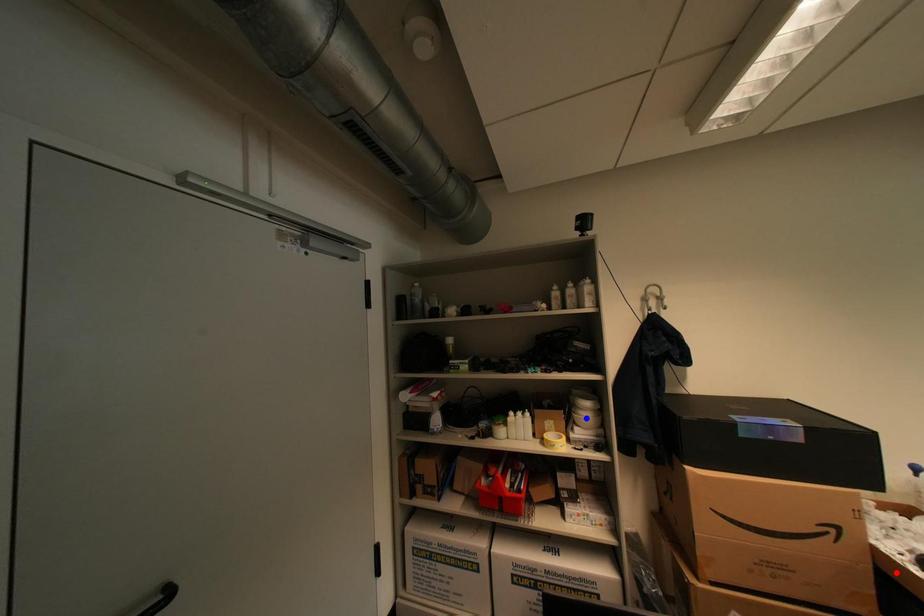
Question: Which of the two points in the image is closer to the camera?

Choices:
 (A) Blue point is closer.
 (B) Red point is closer.

Answer: (B)